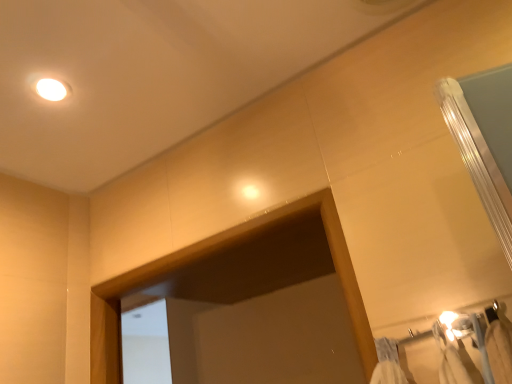
Measure the distance between transparent glass door at center and camera.

transparent glass door at center and camera are 28.15 inches apart from each other.

You are a GUI agent. You are given a task and a screenshot of the screen. Output one action in this format:
    pyautogui.click(x=<x>, y=<y>)
    Task: Click on the transparent glass door at center
    This screenshot has height=384, width=512.
    Given the screenshot: What is the action you would take?
    pyautogui.click(x=240, y=274)

The image size is (512, 384). Describe the element at coordinates (240, 274) in the screenshot. I see `transparent glass door at center` at that location.

You are a GUI agent. You are given a task and a screenshot of the screen. Output one action in this format:
    pyautogui.click(x=<x>, y=<y>)
    Task: Click on the transparent glass door at center
    This screenshot has height=384, width=512.
    Given the screenshot: What is the action you would take?
    pyautogui.click(x=240, y=274)